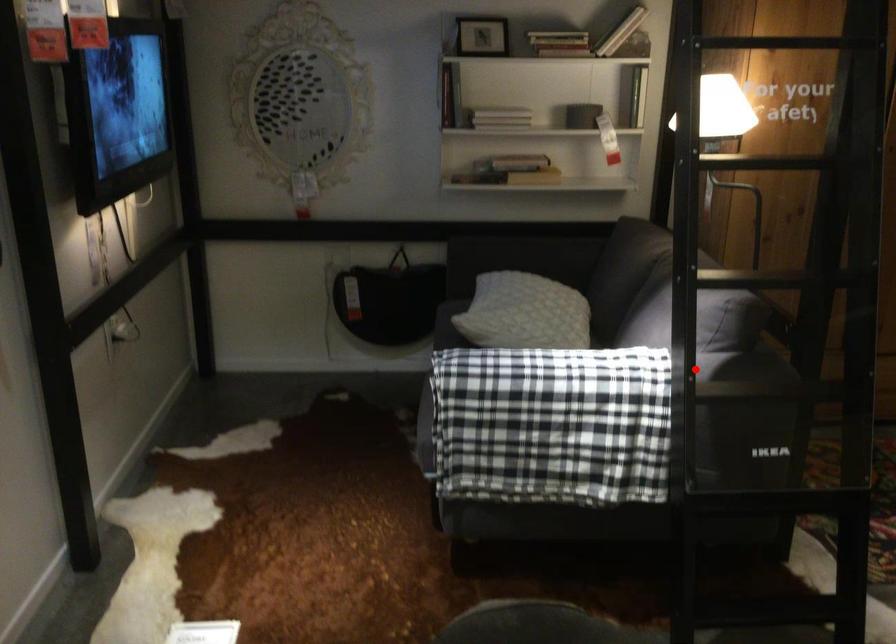
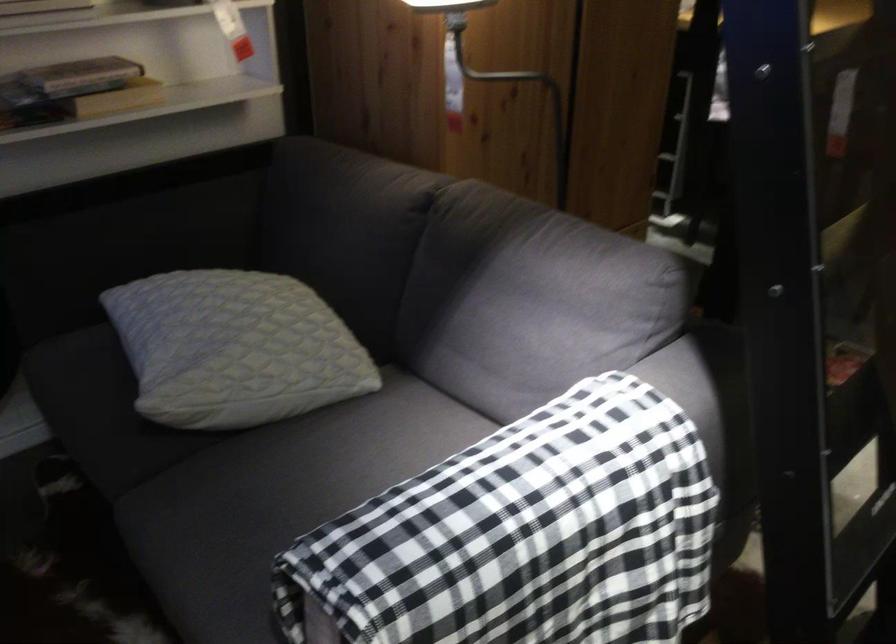
In the second image, find the point that corresponds to the highlighted location in the first image.

(690, 395)